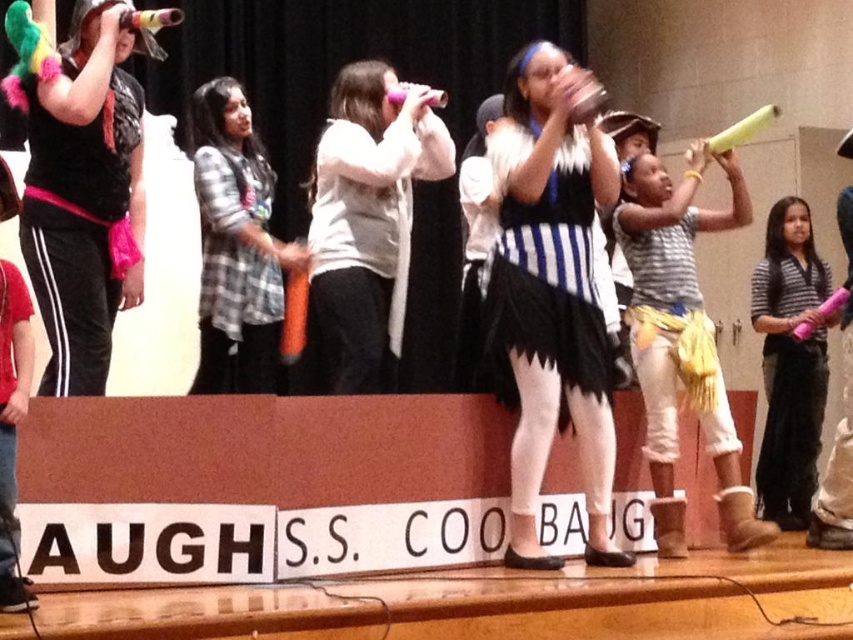
Question: Which object appears farthest from the camera in this image?

Choices:
 (A) white matte skirt at center
 (B) striped shirt at center
 (C) matte black hoodie at upper left
 (D) yellow corduroy skirt at center

Answer: (B)

Question: Is matte black hoodie at upper left to the right of white matte scarf at center from the viewer's perspective?

Choices:
 (A) no
 (B) yes

Answer: (A)

Question: Does white matte skirt at center have a lesser width compared to yellow corduroy skirt at center?

Choices:
 (A) yes
 (B) no

Answer: (A)

Question: Which point is closer to the camera?

Choices:
 (A) (679, 337)
 (B) (535, 344)
 (C) (108, 118)
 (D) (221, 170)

Answer: (C)

Question: Considering the real-world distances, which object is farthest from the matte black hoodie at upper left?

Choices:
 (A) yellow corduroy skirt at center
 (B) striped shirt at center
 (C) white matte skirt at center
 (D) black and white striped skirt at center

Answer: (B)

Question: Does white matte scarf at center appear on the left side of yellow corduroy skirt at center?

Choices:
 (A) yes
 (B) no

Answer: (A)